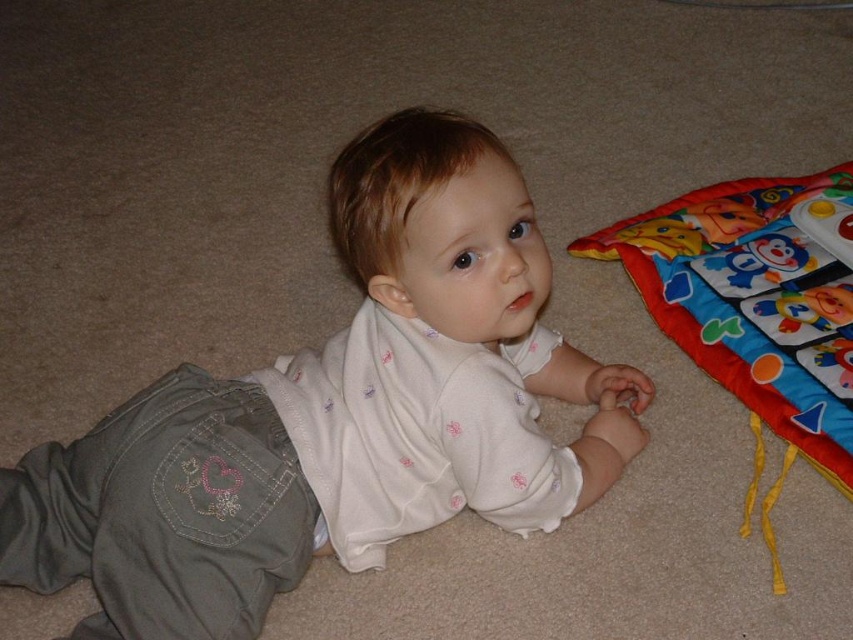
Does white soft baby at center appear on the right side of colorful fabric play mat at lower right?

In fact, white soft baby at center is to the left of colorful fabric play mat at lower right.

Who is shorter, white soft baby at center or colorful fabric play mat at lower right?

With less height is colorful fabric play mat at lower right.

The height and width of the screenshot is (640, 853). What do you see at coordinates (337, 413) in the screenshot? I see `white soft baby at center` at bounding box center [337, 413].

Image resolution: width=853 pixels, height=640 pixels. I want to click on white soft baby at center, so click(337, 413).